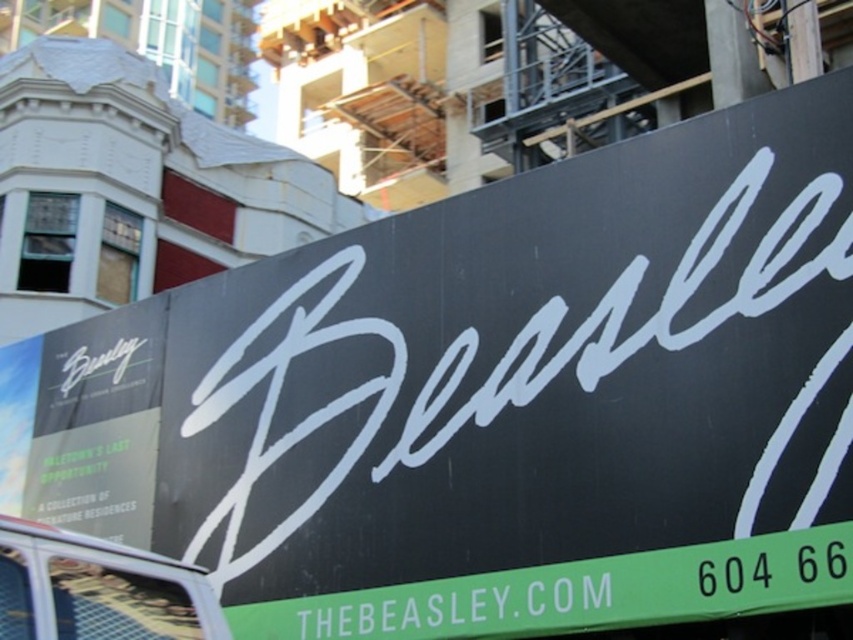
You are a delivery driver who needs to read the phone number on the green matte signboard at bottom and the website on the matte white sign at left. Which sign should you look down towards to find the phone number?

The green matte signboard at bottom is below the matte white sign at left, so you should look down towards the green matte signboard at bottom to find the phone number.

You are a delivery driver trying to navigate through the area shown in the image. There is a matte white sign at left and a metallic silver food truck at lower left. Which object is taller, and how might this affect your route planning?

The matte white sign at left is taller than the metallic silver food truck at lower left. This means the sign might be a better landmark for navigation, while the food truck could be easier to maneuver around due to its lower height.